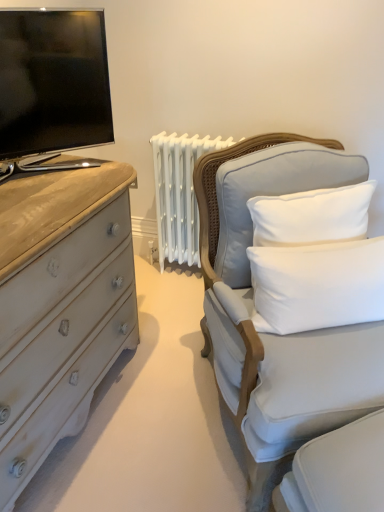
Question: Is white cotton pillow at upper right, the 2th pillow ordered from the bottom, shorter than white soft cushion at right, the second pillow when ordered from top to bottom?

Choices:
 (A) no
 (B) yes

Answer: (A)

Question: Is white cotton pillow at upper right, the 2th pillow ordered from the bottom, to the right of white soft cushion at right, the second pillow when ordered from top to bottom, from the viewer's perspective?

Choices:
 (A) yes
 (B) no

Answer: (B)

Question: From the image's perspective, is white cotton pillow at upper right, the 2th pillow ordered from the bottom, under white soft cushion at right, arranged as the 1th pillow when ordered from the bottom?

Choices:
 (A) no
 (B) yes

Answer: (A)

Question: Does white cotton pillow at upper right, the 1th pillow positioned from the top, have a greater height compared to white soft cushion at right, arranged as the 1th pillow when ordered from the bottom?

Choices:
 (A) yes
 (B) no

Answer: (A)

Question: Is white cotton pillow at upper right, the 1th pillow positioned from the top, to the left of white soft cushion at right, arranged as the 1th pillow when ordered from the bottom, from the viewer's perspective?

Choices:
 (A) no
 (B) yes

Answer: (B)

Question: Considering the positions of white cotton pillow at upper right, the 2th pillow ordered from the bottom, and white soft cushion at right, the second pillow when ordered from top to bottom, in the image, is white cotton pillow at upper right, the 2th pillow ordered from the bottom, wider or thinner than white soft cushion at right, the second pillow when ordered from top to bottom,?

Choices:
 (A) thin
 (B) wide

Answer: (B)

Question: Does point (269, 152) appear closer or farther from the camera than point (292, 290)?

Choices:
 (A) farther
 (B) closer

Answer: (A)

Question: From the image's perspective, relative to white soft cushion at right, the second pillow when ordered from top to bottom, is white cotton pillow at upper right, the 1th pillow positioned from the top, above or below?

Choices:
 (A) above
 (B) below

Answer: (A)

Question: Is white cotton pillow at upper right, the 2th pillow ordered from the bottom, to the left or to the right of white soft cushion at right, the second pillow when ordered from top to bottom, in the image?

Choices:
 (A) left
 (B) right

Answer: (A)

Question: From a real-world perspective, is white soft cushion at right, the second pillow when ordered from top to bottom, physically located above or below light gray fabric chair at right?

Choices:
 (A) above
 (B) below

Answer: (A)

Question: Is white soft cushion at right, the second pillow when ordered from top to bottom, taller or shorter than light gray fabric chair at right?

Choices:
 (A) tall
 (B) short

Answer: (B)

Question: In terms of width, does white soft cushion at right, arranged as the 1th pillow when ordered from the bottom, look wider or thinner when compared to light gray fabric chair at right?

Choices:
 (A) thin
 (B) wide

Answer: (A)

Question: Relative to light gray fabric chair at right, is white soft cushion at right, arranged as the 1th pillow when ordered from the bottom, in front or behind?

Choices:
 (A) front
 (B) behind

Answer: (B)

Question: Looking at their shapes, would you say white soft cushion at right, arranged as the 1th pillow when ordered from the bottom, is wider or thinner than white cotton pillow at upper right, the 1th pillow positioned from the top?

Choices:
 (A) wide
 (B) thin

Answer: (B)

Question: Is point (266, 302) positioned closer to the camera than point (235, 253)?

Choices:
 (A) closer
 (B) farther

Answer: (A)